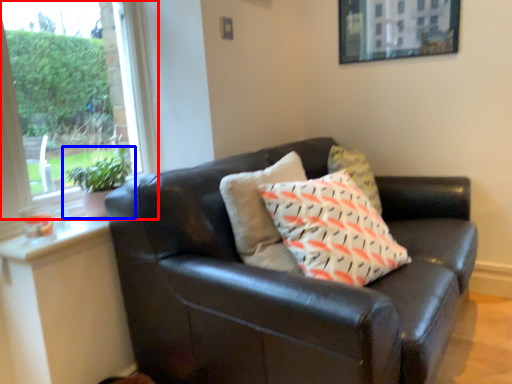
Question: Which point is further to the camera, window (highlighted by a red box) or houseplant (highlighted by a blue box)?

Choices:
 (A) window
 (B) houseplant

Answer: (B)